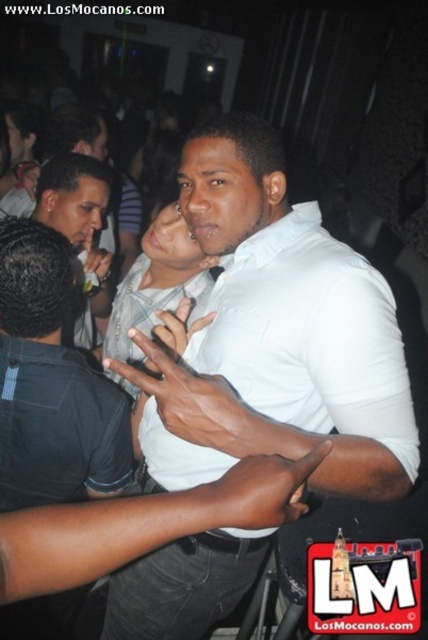
You are a GUI agent. You are given a task and a screenshot of the screen. Output one action in this format:
    pyautogui.click(x=<x>, y=<y>)
    Task: Click on the white matte shirt at center
    
    Given the screenshot: What is the action you would take?
    click(x=276, y=337)

The height and width of the screenshot is (640, 428). Describe the element at coordinates (276, 337) in the screenshot. I see `white matte shirt at center` at that location.

Is point (234, 257) positioned in front of point (112, 352)?

That is True.

Where is `white matte shirt at center`? white matte shirt at center is located at coordinates (276, 337).